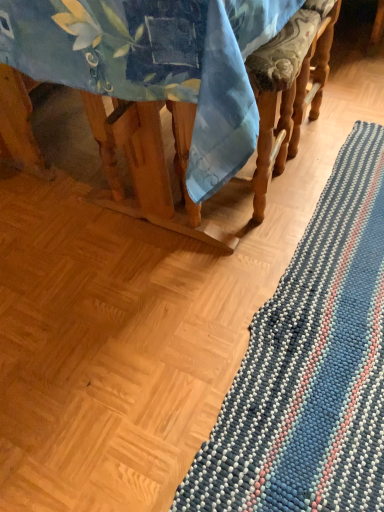
Find the location of a particular element. This screenshot has width=384, height=512. blue fabric tablecloth at upper left is located at coordinates (167, 94).

What do you see at coordinates (167, 94) in the screenshot?
I see `blue fabric tablecloth at upper left` at bounding box center [167, 94].

The image size is (384, 512). What do you see at coordinates (311, 366) in the screenshot? I see `blue striped rug at lower right` at bounding box center [311, 366].

What is the approximate height of blue striped rug at lower right?

blue striped rug at lower right is 4.31 centimeters tall.

At what (x,y) coordinates should I click in order to perform the action: click on blue striped rug at lower right. Please return your answer as a coordinate pair (x, y). Looking at the image, I should click on (311, 366).

At what (x,y) coordinates should I click in order to perform the action: click on blue fabric tablecloth at upper left. Please return your answer as a coordinate pair (x, y). Looking at the image, I should click on (167, 94).

Looking at this image, considering the relative positions of blue striped rug at lower right and blue fabric tablecloth at upper left in the image provided, is blue striped rug at lower right to the right of blue fabric tablecloth at upper left from the viewer's perspective?

Indeed, blue striped rug at lower right is positioned on the right side of blue fabric tablecloth at upper left.

Which object is closer to the camera, blue striped rug at lower right or blue fabric tablecloth at upper left?

Positioned in front is blue fabric tablecloth at upper left.

Considering the positions of point (259, 334) and point (99, 4), is point (259, 334) closer or farther from the camera than point (99, 4)?

Point (259, 334) is positioned farther from the camera compared to point (99, 4).

From the image's perspective, does blue striped rug at lower right appear lower than blue fabric tablecloth at upper left?

Indeed, from the image's perspective, blue striped rug at lower right is shown beneath blue fabric tablecloth at upper left.

From a real-world perspective, is blue striped rug at lower right beneath blue fabric tablecloth at upper left?

Yes, from a real-world perspective, blue striped rug at lower right is beneath blue fabric tablecloth at upper left.

Between blue striped rug at lower right and blue fabric tablecloth at upper left, which one has smaller width?

blue striped rug at lower right.

Which of these two, blue striped rug at lower right or blue fabric tablecloth at upper left, stands taller?

blue fabric tablecloth at upper left.

Is blue striped rug at lower right bigger or smaller than blue fabric tablecloth at upper left?

blue striped rug at lower right is smaller than blue fabric tablecloth at upper left.

Looking at this image, would you say blue fabric tablecloth at upper left is part of blue striped rug at lower right's contents?

No, blue fabric tablecloth at upper left is not inside blue striped rug at lower right.

Are blue striped rug at lower right and blue fabric tablecloth at upper left making contact?

They are not placed beside each other.

Is blue fabric tablecloth at upper left at the back of blue striped rug at lower right?

No, blue striped rug at lower right is not facing the opposite direction of blue fabric tablecloth at upper left.

How many degrees apart are the facing directions of blue striped rug at lower right and blue fabric tablecloth at upper left?

The angular difference between blue striped rug at lower right and blue fabric tablecloth at upper left is 180 degrees.

Identify the location of furniture positioned vertically above the blue striped rug at lower right (from a real-world perspective). The width and height of the screenshot is (384, 512). (167, 94).

Considering the relative positions of blue fabric tablecloth at upper left and blue striped rug at lower right in the image provided, is blue fabric tablecloth at upper left to the right of blue striped rug at lower right from the viewer's perspective?

Incorrect, blue fabric tablecloth at upper left is not on the right side of blue striped rug at lower right.

Is the position of blue fabric tablecloth at upper left less distant than that of blue striped rug at lower right?

Yes, blue fabric tablecloth at upper left is closer to the camera.

Which point is more distant from viewer, (121, 47) or (272, 456)?

The point (272, 456) is more distant.

Consider the image. From the image's perspective, does blue fabric tablecloth at upper left appear lower than blue striped rug at lower right?

Actually, blue fabric tablecloth at upper left appears above blue striped rug at lower right in the image.

From a real-world perspective, between blue fabric tablecloth at upper left and blue striped rug at lower right, who is vertically lower?

blue striped rug at lower right is physically lower.

Does blue fabric tablecloth at upper left have a lesser width compared to blue striped rug at lower right?

In fact, blue fabric tablecloth at upper left might be wider than blue striped rug at lower right.

Considering the sizes of objects blue fabric tablecloth at upper left and blue striped rug at lower right in the image provided, who is shorter, blue fabric tablecloth at upper left or blue striped rug at lower right?

Result: blue striped rug at lower right is shorter.

Does blue fabric tablecloth at upper left have a smaller size compared to blue striped rug at lower right?

Incorrect, blue fabric tablecloth at upper left is not smaller in size than blue striped rug at lower right.

Consider the image. Does blue fabric tablecloth at upper left contain blue striped rug at lower right?

No, blue striped rug at lower right is not a part of blue fabric tablecloth at upper left.

Is blue fabric tablecloth at upper left next to blue striped rug at lower right?

There is a gap between blue fabric tablecloth at upper left and blue striped rug at lower right.

Is blue fabric tablecloth at upper left positioned with its back to blue striped rug at lower right?

blue fabric tablecloth at upper left does not have its back to blue striped rug at lower right.

What's the angular difference between blue fabric tablecloth at upper left and blue striped rug at lower right's facing directions?

The facing directions of blue fabric tablecloth at upper left and blue striped rug at lower right are 180 degrees apart.

How much distance is there between blue fabric tablecloth at upper left and blue striped rug at lower right?

blue fabric tablecloth at upper left and blue striped rug at lower right are 17.39 inches apart from each other.

Find the location of a particular element. This screenshot has height=512, width=384. mat behind the blue fabric tablecloth at upper left is located at coordinates (311, 366).

Locate an element on the screen. This screenshot has height=512, width=384. furniture in front of the blue striped rug at lower right is located at coordinates (167, 94).

Identify the location of furniture above the blue striped rug at lower right (from a real-world perspective). (167, 94).